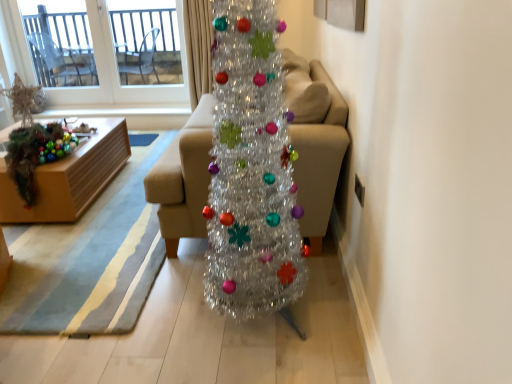
Locate an element on the screen. This screenshot has height=384, width=512. vacant space positioned to the left of shiny metallic christmas tree at center is located at coordinates (157, 308).